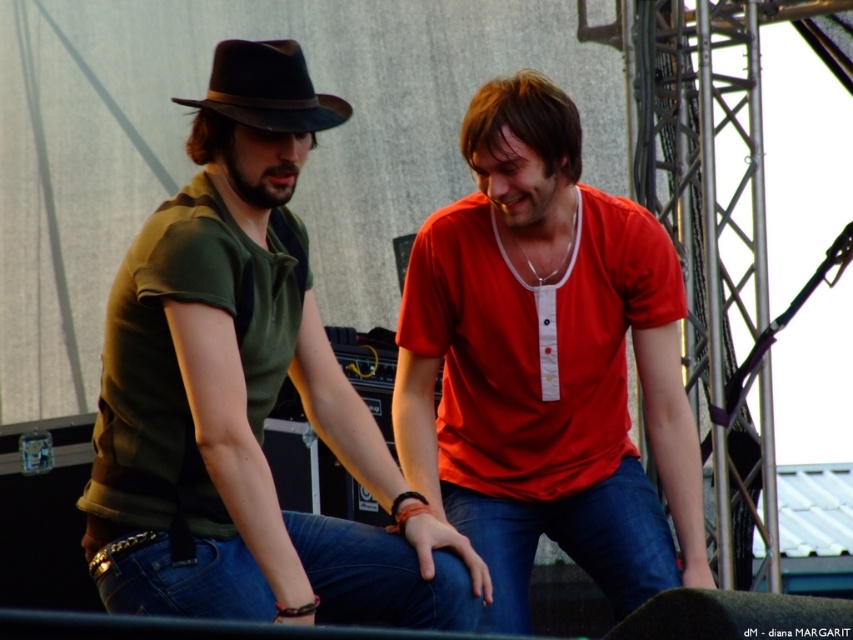
Between green matte shirt at center and black felt fedora at upper left, which one is positioned higher?

black felt fedora at upper left is higher up.

Who is positioned more to the left, green matte shirt at center or black felt fedora at upper left?

Positioned to the left is black felt fedora at upper left.

Locate an element on the screen. The width and height of the screenshot is (853, 640). green matte shirt at center is located at coordinates (247, 396).

Is green matte shirt at center to the left of red matte shirt at center from the viewer's perspective?

Correct, you'll find green matte shirt at center to the left of red matte shirt at center.

Who is higher up, green matte shirt at center or red matte shirt at center?

red matte shirt at center is higher up.

The height and width of the screenshot is (640, 853). What do you see at coordinates (247, 396) in the screenshot? I see `green matte shirt at center` at bounding box center [247, 396].

Where is `green matte shirt at center`? green matte shirt at center is located at coordinates (247, 396).

Who is positioned more to the right, red matte shirt at center or denim at center?

denim at center

Who is higher up, red matte shirt at center or denim at center?

red matte shirt at center is higher up.

Identify the location of red matte shirt at center. Image resolution: width=853 pixels, height=640 pixels. (546, 364).